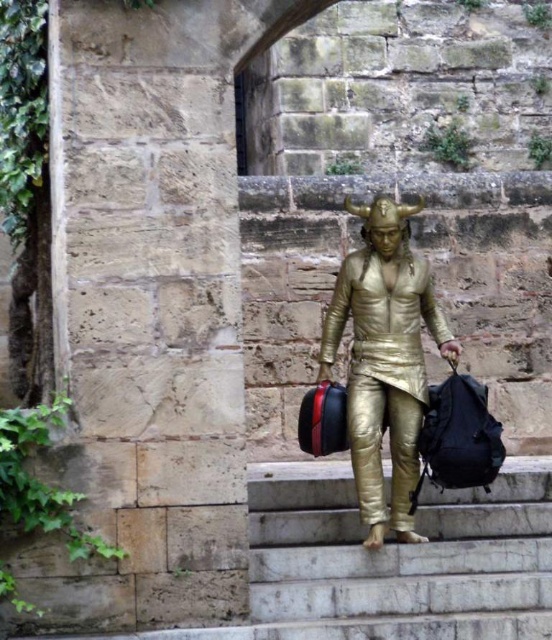
Question: Which point is closer to the camera taking this photo?

Choices:
 (A) (412, 470)
 (B) (436, 481)
 (C) (304, 396)

Answer: (B)

Question: Is gold metallic suit at center bigger than black fabric backpack at center?

Choices:
 (A) yes
 (B) no

Answer: (A)

Question: Does gold metallic suit at center have a larger size compared to black fabric backpack at center?

Choices:
 (A) yes
 (B) no

Answer: (A)

Question: Is gold metallic suit at center behind shiny metallic bag at center?

Choices:
 (A) no
 (B) yes

Answer: (A)

Question: Which point appears closest to the camera in this image?

Choices:
 (A) (315, 419)
 (B) (469, 461)
 (C) (385, 385)

Answer: (B)

Question: Which object appears closest to the camera in this image?

Choices:
 (A) gold metallic suit at center
 (B) black fabric backpack at center

Answer: (A)